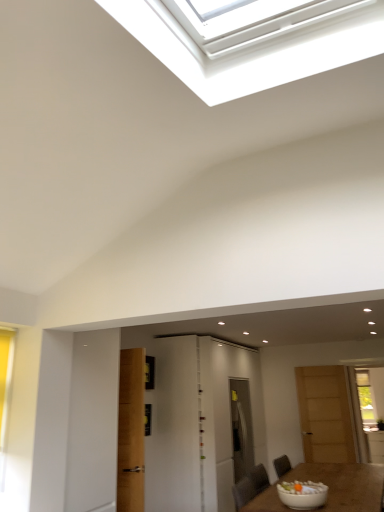
Question: Is white glossy bowl at lower right bigger or smaller than wooden door at right, marked as the 3th door in a left-to-right arrangement?

Choices:
 (A) small
 (B) big

Answer: (A)

Question: From a real-world perspective, is white glossy bowl at lower right positioned above or below wooden door at right, which is the first door in right-to-left order?

Choices:
 (A) above
 (B) below

Answer: (B)

Question: Which object is positioned closest to the wooden door at right, marked as the 3th door in a left-to-right arrangement?

Choices:
 (A) white glossy door at center, placed as the 2th door when sorted from left to right
 (B) white glossy door at center, which is counted as the 1th door, starting from the left
 (C) white glossy bowl at lower right
 (D) brown wooden table at lower center

Answer: (D)

Question: Which object is positioned closest to the wooden door at right, marked as the 3th door in a left-to-right arrangement?

Choices:
 (A) brown wooden table at lower center
 (B) white glossy door at center, which is counted as the 3th door, starting from the right
 (C) white glossy door at center, marked as the second door in a right-to-left arrangement
 (D) white glossy bowl at lower right

Answer: (A)